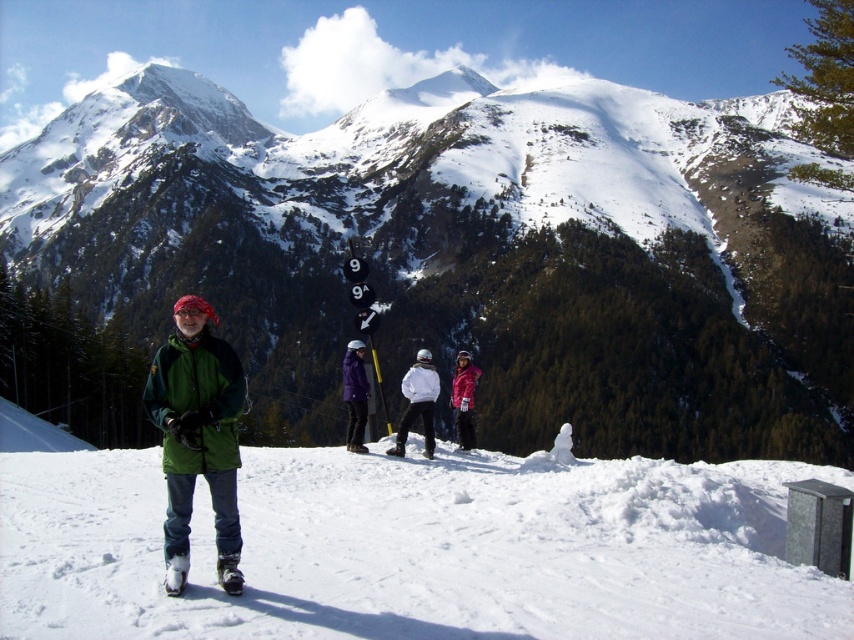
Question: Is snowy mountain at center below purple matte jacket at center?

Choices:
 (A) yes
 (B) no

Answer: (B)

Question: Based on their relative distances, which object is farther from the snowy mountain at center?

Choices:
 (A) white matte jacket at center
 (B) matte pink snowsuit at center
 (C) purple matte jacket at center
 (D) white snow at center

Answer: (C)

Question: Estimate the real-world distances between objects in this image. Which object is farther from the green matte jacket at center?

Choices:
 (A) snowy mountain at center
 (B) matte pink snowsuit at center
 (C) white snow at center
 (D) white matte jacket at center

Answer: (A)

Question: Is snowy mountain at center bigger than matte pink snowsuit at center?

Choices:
 (A) yes
 (B) no

Answer: (A)

Question: Does white snow at center have a smaller size compared to green matte jacket at center?

Choices:
 (A) no
 (B) yes

Answer: (B)

Question: Which object is farther from the camera taking this photo?

Choices:
 (A) purple matte jacket at center
 (B) white matte jacket at center

Answer: (A)